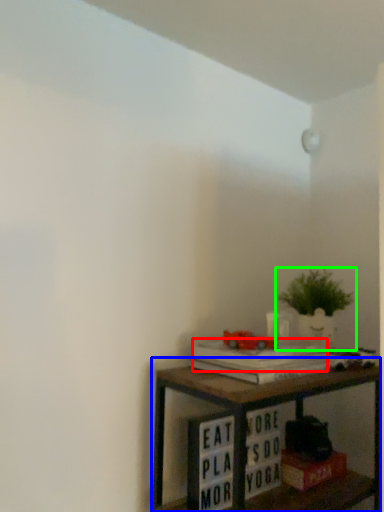
Question: Which object is the farthest from paperback book (highlighted by a red box)? Choose among these: shelf (highlighted by a blue box) or houseplant (highlighted by a green box).

Choices:
 (A) shelf
 (B) houseplant

Answer: (B)